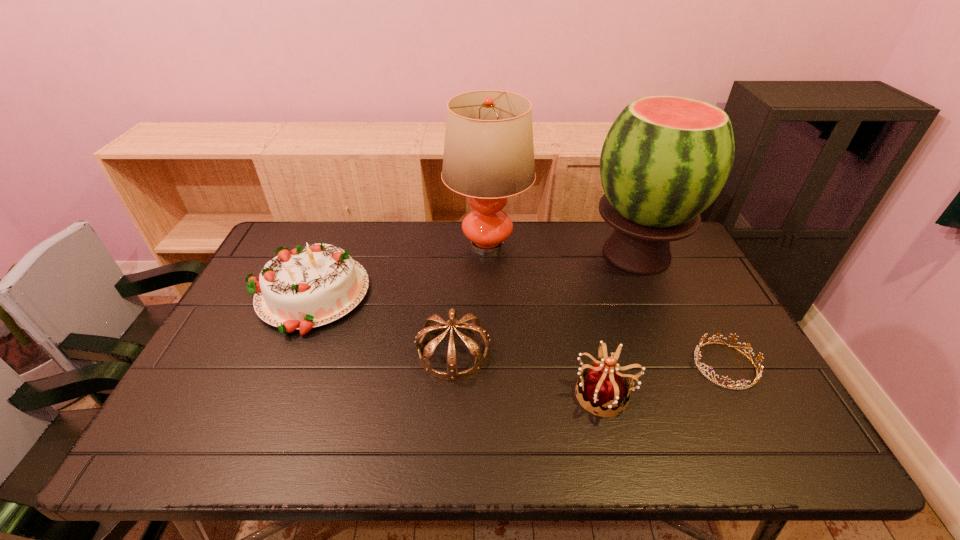
Locate an element on the screen. This screenshot has width=960, height=540. lamp is located at coordinates point(488,156).

The image size is (960, 540). Find the location of `watermelon`. watermelon is located at coordinates (665, 159).

This screenshot has width=960, height=540. Find the location of `the leftmost object`. the leftmost object is located at coordinates (310, 286).

Find the location of `the fourth shortest object`. the fourth shortest object is located at coordinates (310, 286).

In order to click on the second tiara from right to left in this screenshot , I will do `click(604, 386)`.

The image size is (960, 540). What are the coordinates of `the third shortest object` in the screenshot? It's located at (604, 386).

Where is `the second shortest tiara`? the second shortest tiara is located at coordinates (429, 328).

Find the location of `the fifth tallest object`. the fifth tallest object is located at coordinates (429, 328).

Find the location of a particular element. the rightmost tiara is located at coordinates (758, 375).

Locate an element on the screen. The height and width of the screenshot is (540, 960). the shortest object is located at coordinates (758, 375).